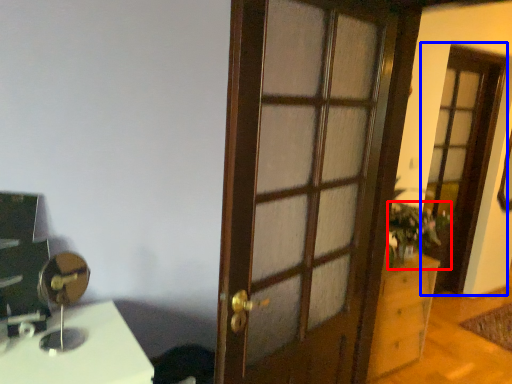
Question: Which of the following is the closest to the observer, houseplant (highlighted by a red box) or screen door (highlighted by a blue box)?

Choices:
 (A) houseplant
 (B) screen door

Answer: (A)